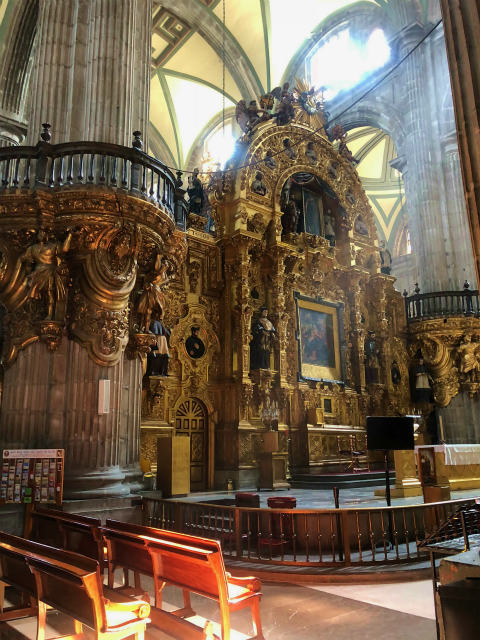
Where is `painting`? painting is located at coordinates (308, 331).